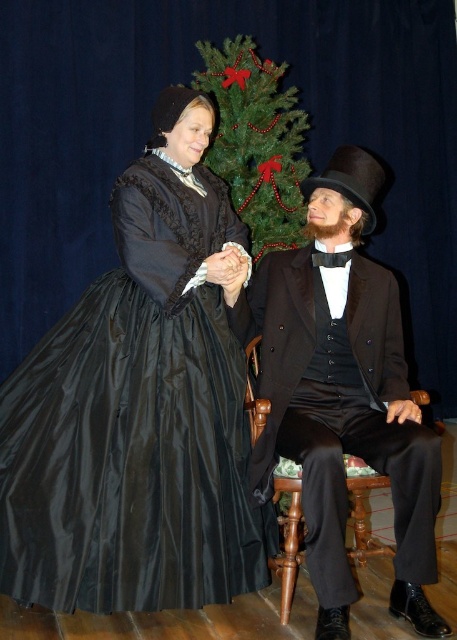
Question: Can you confirm if matte black suit at center is positioned above green textured christmas tree at center?

Choices:
 (A) no
 (B) yes

Answer: (A)

Question: Which object is closer to the camera taking this photo?

Choices:
 (A) matte black suit at center
 (B) matte black dress at center
 (C) green textured christmas tree at center

Answer: (A)

Question: Is matte black suit at center above green textured christmas tree at center?

Choices:
 (A) yes
 (B) no

Answer: (B)

Question: Does matte black dress at center appear on the right side of green textured christmas tree at center?

Choices:
 (A) no
 (B) yes

Answer: (A)

Question: Which object is closer to the camera taking this photo?

Choices:
 (A) green textured christmas tree at center
 (B) matte black dress at center
 (C) matte black suit at center

Answer: (C)

Question: Which is nearer to the matte black dress at center?

Choices:
 (A) matte black suit at center
 (B) green textured christmas tree at center

Answer: (A)